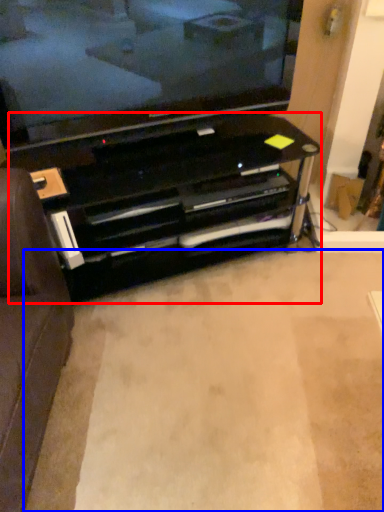
Question: Which object appears closest to the camera in this image, entertainment center (highlighted by a red box) or plain (highlighted by a blue box)?

Choices:
 (A) entertainment center
 (B) plain

Answer: (B)